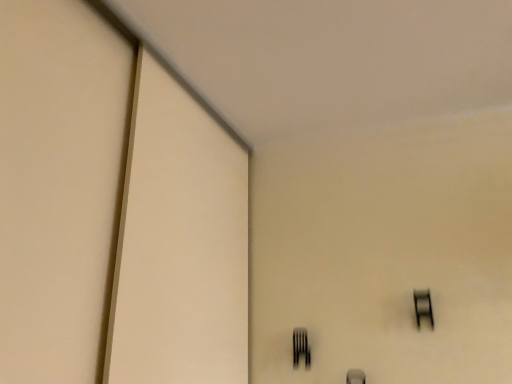
At what (x,y) coordinates should I click in order to perform the action: click on black glass window at upper right. Please return your answer as a coordinate pair (x, y). This screenshot has height=384, width=512. Looking at the image, I should click on tap(423, 306).

The width and height of the screenshot is (512, 384). Describe the element at coordinates (423, 306) in the screenshot. I see `black glass window at upper right` at that location.

What is the approximate width of black glass window at upper right?

black glass window at upper right is 2.15 inches in width.

I want to click on black matte fork at lower center, so click(301, 347).

Describe the element at coordinates (301, 347) in the screenshot. I see `black matte fork at lower center` at that location.

This screenshot has width=512, height=384. In order to click on black glass window at upper right in this screenshot , I will do `click(423, 306)`.

Is black glass window at upper right at the right side of black matte fork at lower center?

Yes.

In the image, is black glass window at upper right positioned in front of or behind black matte fork at lower center?

black glass window at upper right is in front of black matte fork at lower center.

Does point (414, 289) come farther from viewer compared to point (307, 360)?

That is False.

From the image's perspective, is black glass window at upper right over black matte fork at lower center?

Correct, black glass window at upper right appears higher than black matte fork at lower center in the image.

From a real-world perspective, is black glass window at upper right physically located above or below black matte fork at lower center?

Clearly, from a real-world perspective, black glass window at upper right is above black matte fork at lower center.

From the picture: Which object is wider, black glass window at upper right or black matte fork at lower center?

black matte fork at lower center is wider.

Considering the sizes of objects black glass window at upper right and black matte fork at lower center in the image provided, who is shorter, black glass window at upper right or black matte fork at lower center?

black matte fork at lower center is shorter.

Considering the sizes of objects black glass window at upper right and black matte fork at lower center in the image provided, who is bigger, black glass window at upper right or black matte fork at lower center?

black glass window at upper right.

Is black matte fork at lower center completely or partially inside black glass window at upper right?

That's incorrect, black matte fork at lower center is not inside black glass window at upper right.

Is black glass window at upper right positioned far away from black matte fork at lower center?

No, there isn't a large distance between black glass window at upper right and black matte fork at lower center.

Could you tell me if black glass window at upper right is facing black matte fork at lower center?

No, black glass window at upper right is not aimed at black matte fork at lower center.

Image resolution: width=512 pixels, height=384 pixels. What are the coordinates of `window in front of the black matte fork at lower center` in the screenshot? It's located at (423, 306).

Which is more to the left, black matte fork at lower center or black glass window at upper right?

black matte fork at lower center is more to the left.

Is black matte fork at lower center in front of black glass window at upper right?

No, it is behind black glass window at upper right.

Which is in front, point (294, 357) or point (422, 291)?

The point (422, 291) is in front.

From the image's perspective, does black matte fork at lower center appear lower than black glass window at upper right?

Indeed, from the image's perspective, black matte fork at lower center is shown beneath black glass window at upper right.

From a real-world perspective, is black matte fork at lower center above or below black glass window at upper right?

black matte fork at lower center is below black glass window at upper right.

Considering the relative sizes of black matte fork at lower center and black glass window at upper right in the image provided, is black matte fork at lower center wider than black glass window at upper right?

Yes.

Which of these two, black matte fork at lower center or black glass window at upper right, stands taller?

With more height is black glass window at upper right.

Is black matte fork at lower center bigger than black glass window at upper right?

No.

Is black matte fork at lower center surrounding black glass window at upper right?

Definitely not — black glass window at upper right is not inside black matte fork at lower center.

Is there a large distance between black matte fork at lower center and black glass window at upper right?

No.

Is black matte fork at lower center facing towards black glass window at upper right?

No, black matte fork at lower center is not oriented towards black glass window at upper right.

Can you tell me how much black matte fork at lower center and black glass window at upper right differ in facing direction?

The facing directions of black matte fork at lower center and black glass window at upper right are 0.00133 degrees apart.

How far apart are black matte fork at lower center and black glass window at upper right?

black matte fork at lower center and black glass window at upper right are 16.76 inches apart from each other.

This screenshot has height=384, width=512. Identify the location of fork behind the black glass window at upper right. (301, 347).

Find the location of a particular element. The width and height of the screenshot is (512, 384). fork behind the black glass window at upper right is located at coordinates (301, 347).

Find the location of a particular element. The width and height of the screenshot is (512, 384). fork on the left of black glass window at upper right is located at coordinates [x=301, y=347].